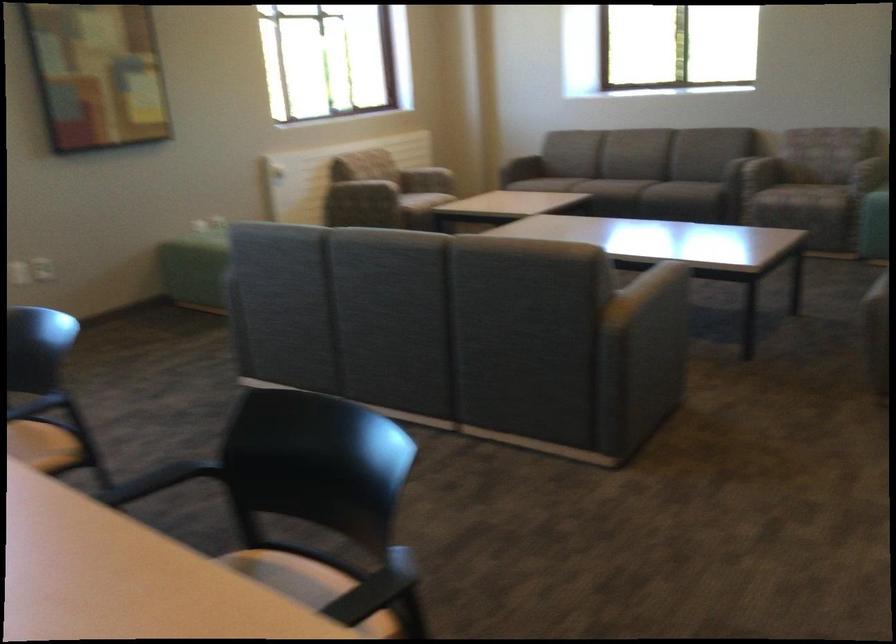
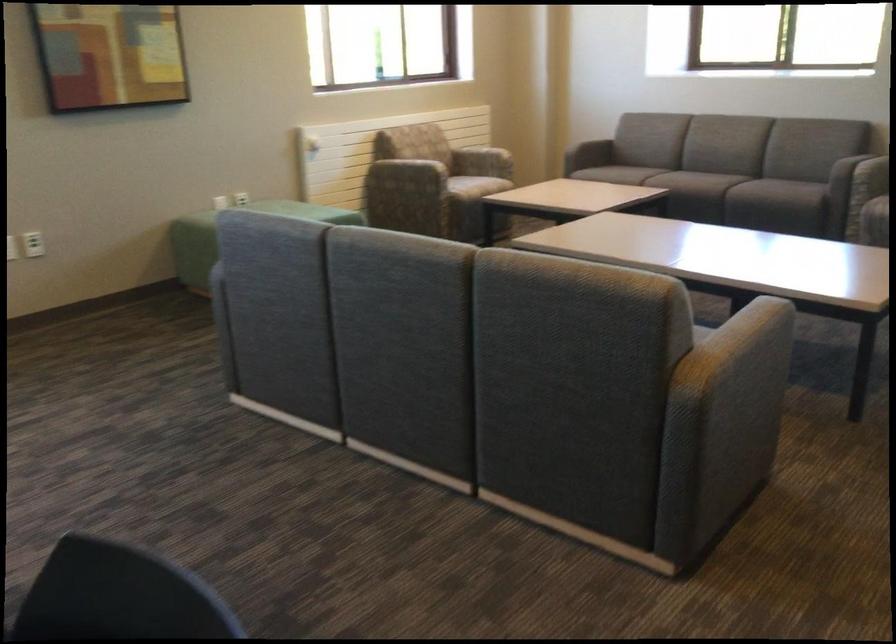
Question: The camera is either moving clockwise (left) or counter-clockwise (right) around the object. The first image is from the beginning of the video and the second image is from the end. Is the camera moving left or right when shooting the video?

Choices:
 (A) Left
 (B) Right

Answer: (B)